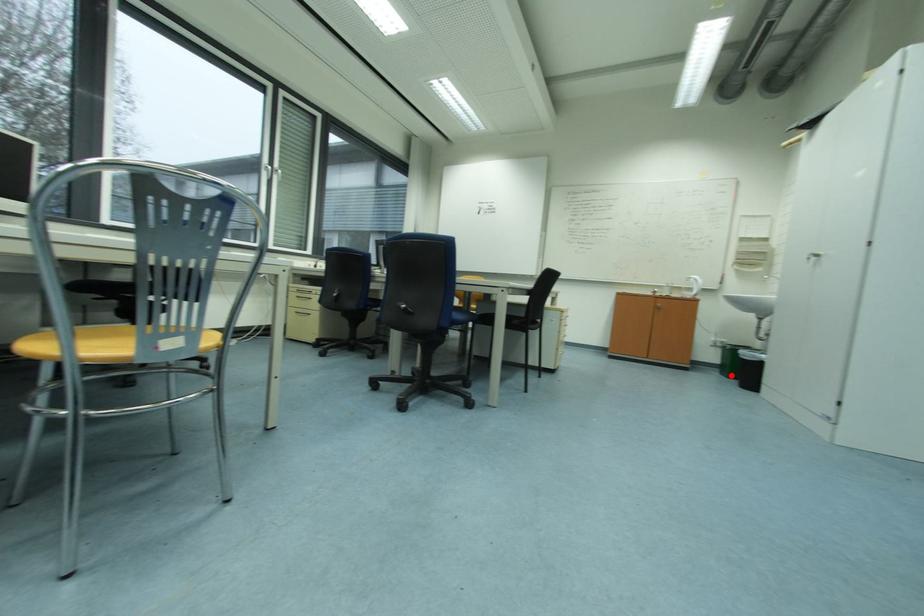
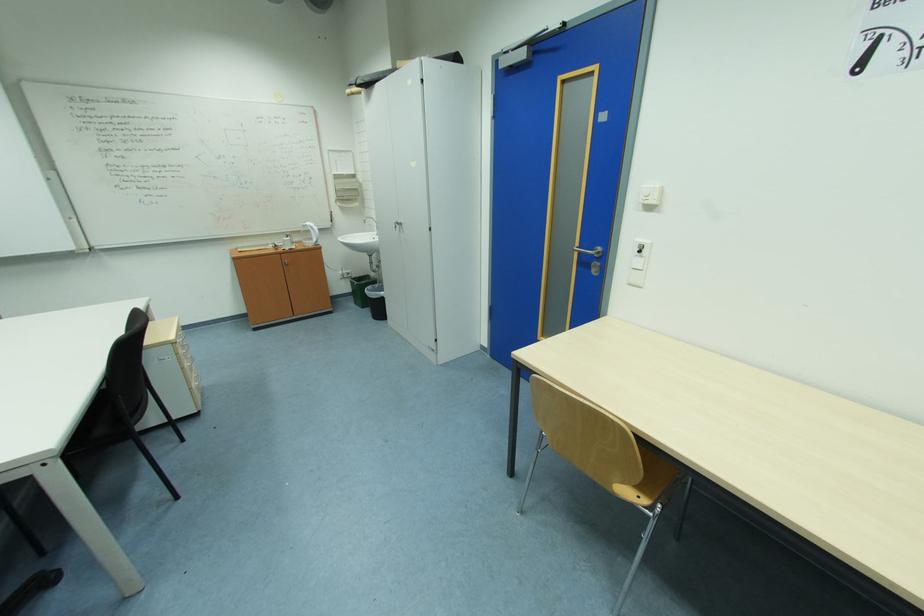
The point at the highlighted location is marked in the first image. Where is the corresponding point in the second image?

(362, 304)